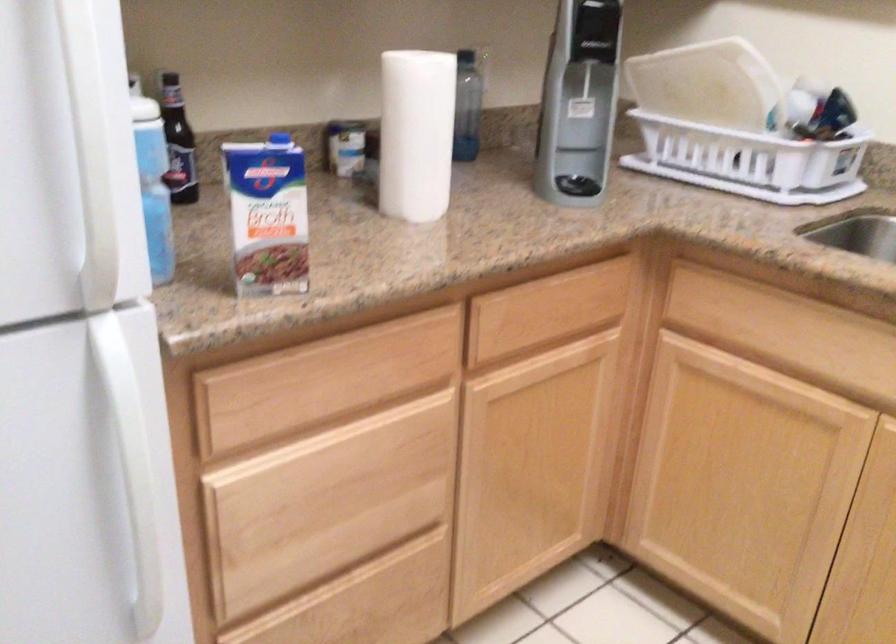
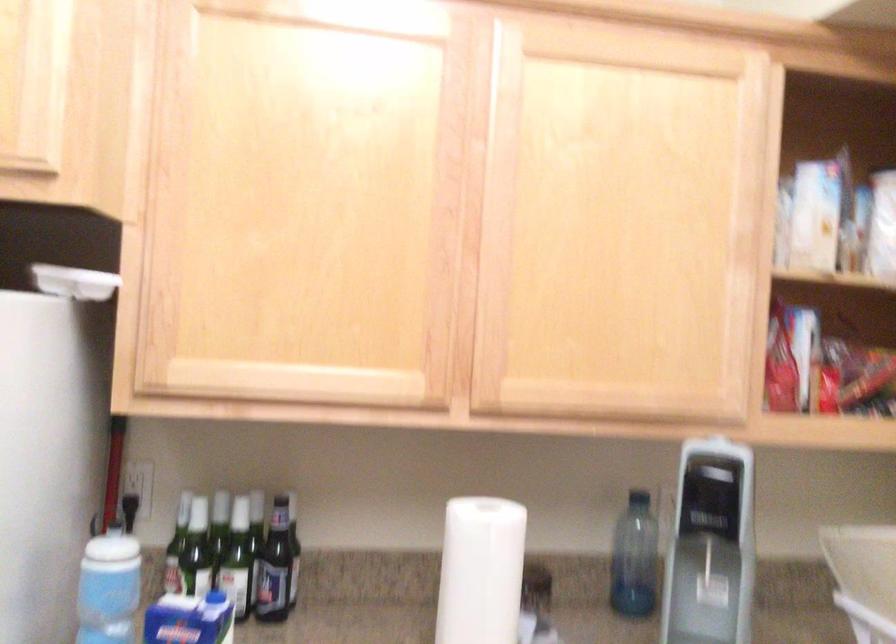
The point at (286, 145) is marked in the first image. Where is the corresponding point in the second image?

(216, 597)